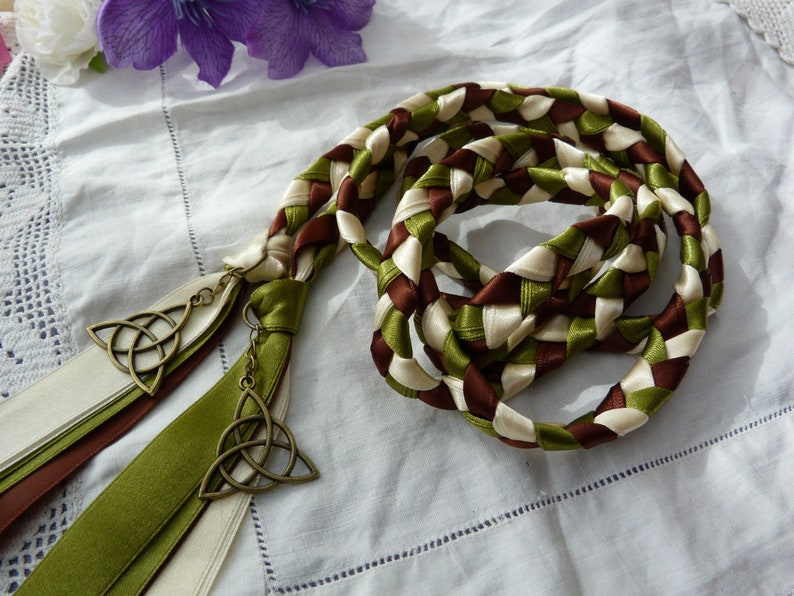
This screenshot has width=794, height=596. In order to click on lace in this screenshot , I will do `click(29, 280)`, `click(21, 173)`, `click(780, 21)`.